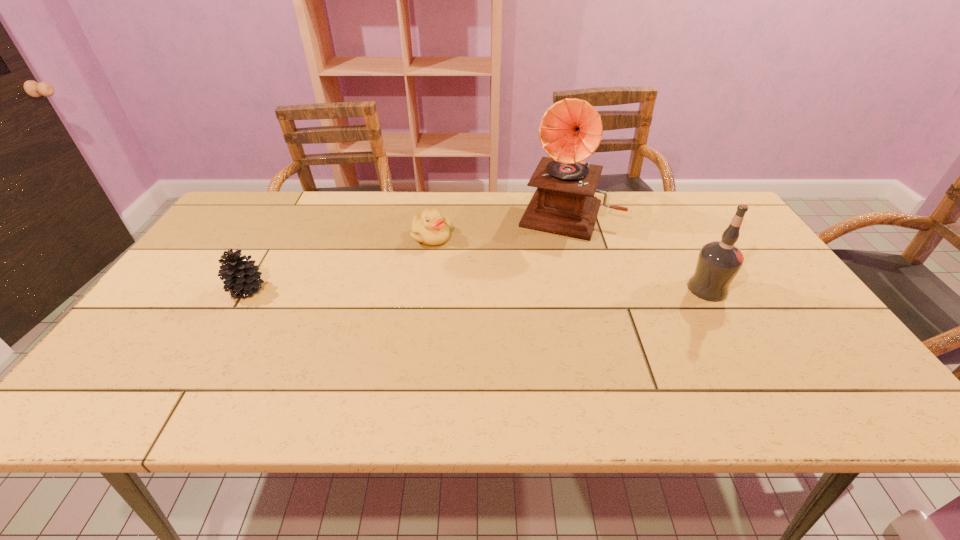
Locate an element on the screen. Image resolution: width=960 pixels, height=540 pixels. vacant area that lies between the second object from left to right and the tallest object is located at coordinates (500, 225).

Find the location of `vacant area that lies between the tallest object and the vodka`. vacant area that lies between the tallest object and the vodka is located at coordinates tap(637, 252).

I want to click on blank region between the second object from left to right and the third tallest object, so click(x=339, y=263).

Locate an element on the screen. The image size is (960, 540). blank region between the duckling and the third shortest object is located at coordinates (569, 262).

Identify the location of vacant area that lies between the third shortest object and the shortest object. This screenshot has width=960, height=540. (x=569, y=262).

The height and width of the screenshot is (540, 960). I want to click on object that is the second closest to the third shortest object, so click(x=430, y=228).

Find the location of `object that is the second closest to the second object from left to right`. object that is the second closest to the second object from left to right is located at coordinates (x=242, y=278).

At what (x,y) coordinates should I click in order to perform the action: click on free region that satisfies the following two spatial constraints: 1. on the front side of the third object from right to left; 2. on the front label of the rightmost object. Please return your answer as a coordinate pair (x, y). Image resolution: width=960 pixels, height=540 pixels. Looking at the image, I should click on (424, 289).

Identify the location of blank space that satisfies the following two spatial constraints: 1. on the front side of the rightmost object; 2. on the front label of the tallest object. This screenshot has width=960, height=540. (588, 289).